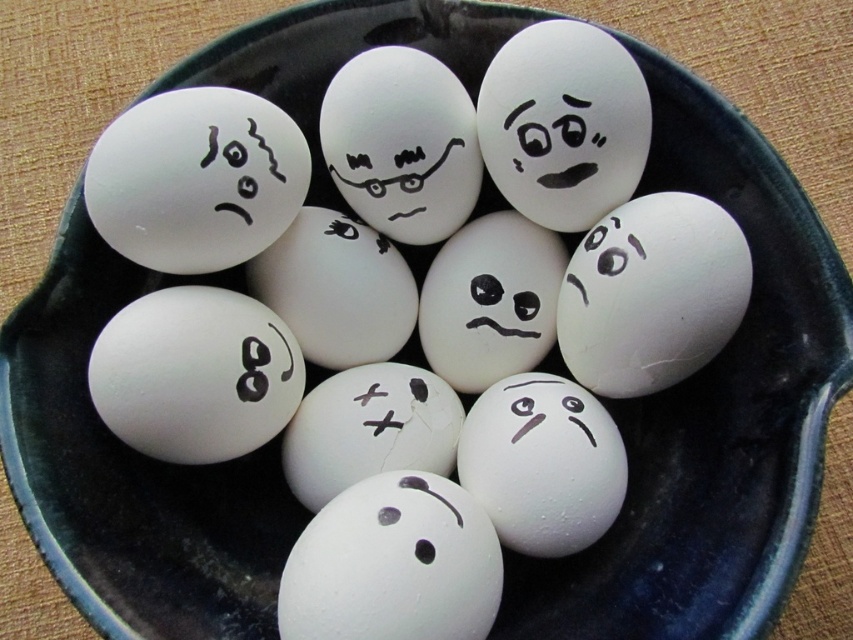
Question: Which point is closer to the camera?

Choices:
 (A) (524, 113)
 (B) (505, 118)

Answer: (A)

Question: Which point appears farthest from the camera in this image?

Choices:
 (A) (544, 22)
 (B) (566, 170)

Answer: (A)

Question: Is white matte egg at upper center behind white matte egg at center?

Choices:
 (A) no
 (B) yes

Answer: (A)

Question: From the image, what is the correct spatial relationship of white matte egg at upper center in relation to white matte egg at center?

Choices:
 (A) above
 (B) below

Answer: (A)

Question: Does white matte egg at upper center appear over white matte egg at center?

Choices:
 (A) no
 (B) yes

Answer: (B)

Question: Which of the following is the farthest from the observer?

Choices:
 (A) (614, 189)
 (B) (540, 172)

Answer: (A)